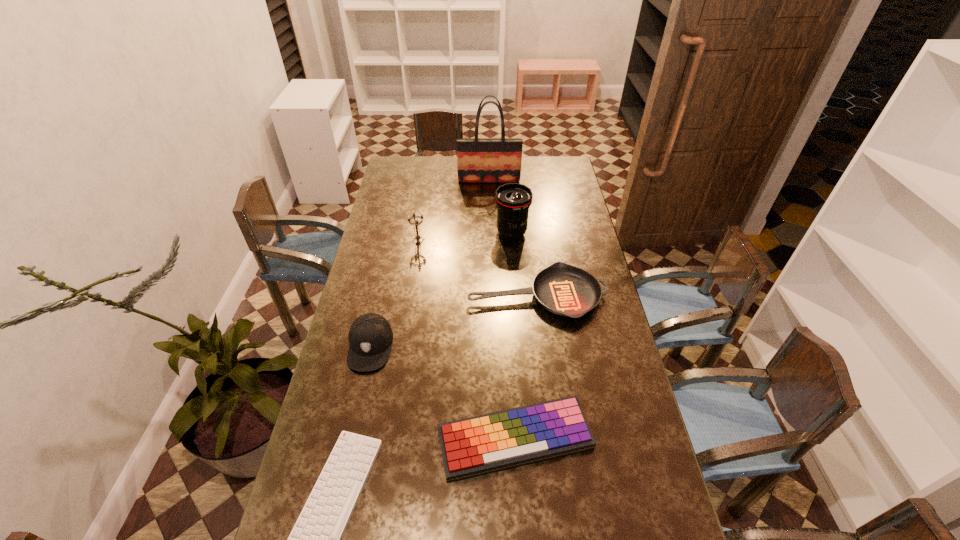
Locate an element on the screen. This screenshot has width=960, height=540. shopping bag is located at coordinates (479, 160).

Locate an element on the screen. the tallest object is located at coordinates (479, 160).

This screenshot has height=540, width=960. In order to click on the second tallest object in this screenshot , I will do `click(513, 200)`.

Image resolution: width=960 pixels, height=540 pixels. In order to click on candle holder in this screenshot , I will do `click(416, 222)`.

Image resolution: width=960 pixels, height=540 pixels. What are the coordinates of `cap` in the screenshot? It's located at (370, 336).

Identify the location of the right computer keyboard. The image size is (960, 540). [x=482, y=444].

Locate an element on the screen. This screenshot has width=960, height=540. frying pan is located at coordinates (563, 289).

Where is `vacant region located 0.230m on the front-facing side of the tallest object`? vacant region located 0.230m on the front-facing side of the tallest object is located at coordinates (490, 213).

The width and height of the screenshot is (960, 540). I want to click on blank area located on the back of the telephoto lens, so click(x=510, y=209).

I want to click on free space located on the back of the fifth shortest object, so click(420, 225).